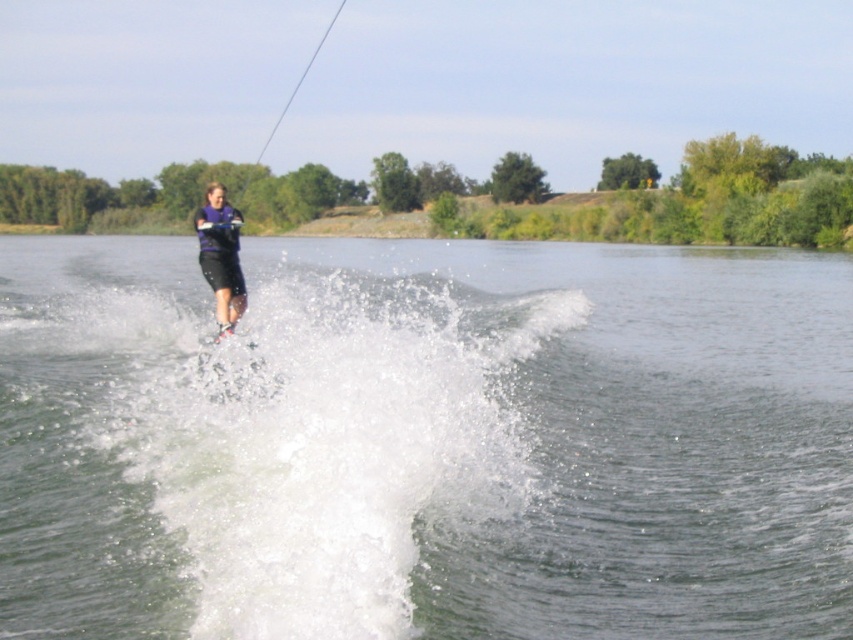
Question: Does clear water at center have a smaller size compared to purple matte shorts at center?

Choices:
 (A) no
 (B) yes

Answer: (B)

Question: Which of the following is the closest to the observer?

Choices:
 (A) (238, 285)
 (B) (793, 282)

Answer: (A)

Question: Which of the following is the closest to the observer?

Choices:
 (A) purple matte shorts at center
 (B) clear water at center

Answer: (B)

Question: Is clear water at center further to camera compared to purple matte shorts at center?

Choices:
 (A) no
 (B) yes

Answer: (A)

Question: In this image, where is clear water at center located relative to purple matte shorts at center?

Choices:
 (A) above
 (B) below

Answer: (B)

Question: Which object is closer to the camera taking this photo?

Choices:
 (A) clear water at center
 (B) purple matte shorts at center

Answer: (A)